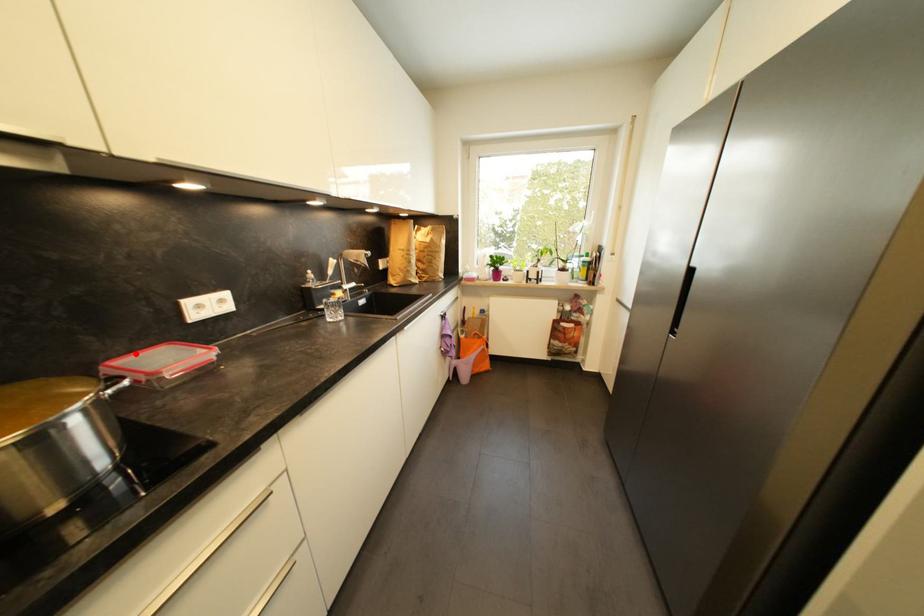
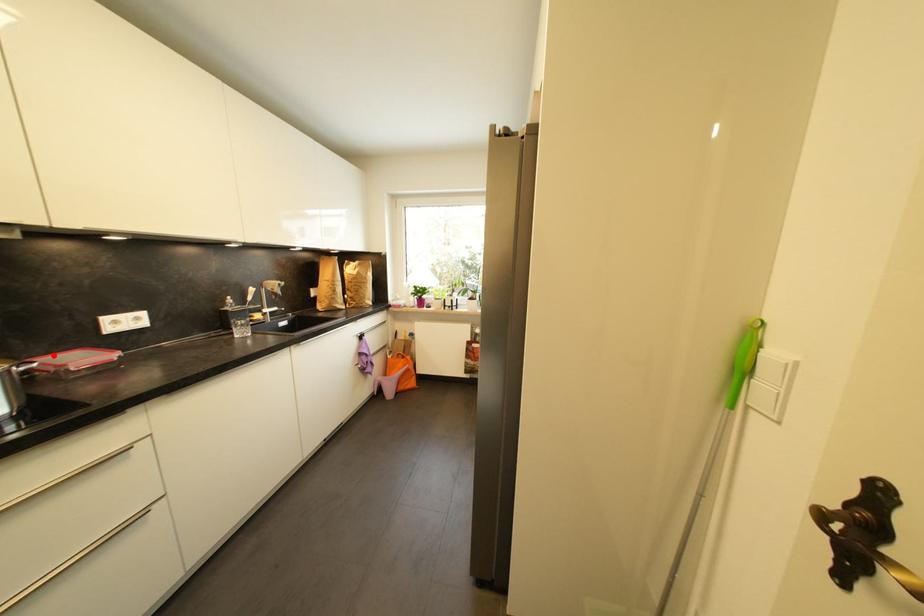
I am providing you with two images of the same scene from different viewpoints. A red point is marked on the first image and another point is marked on the second image. Are the points marked in image1 and image2 representing the same 3D position?

Yes